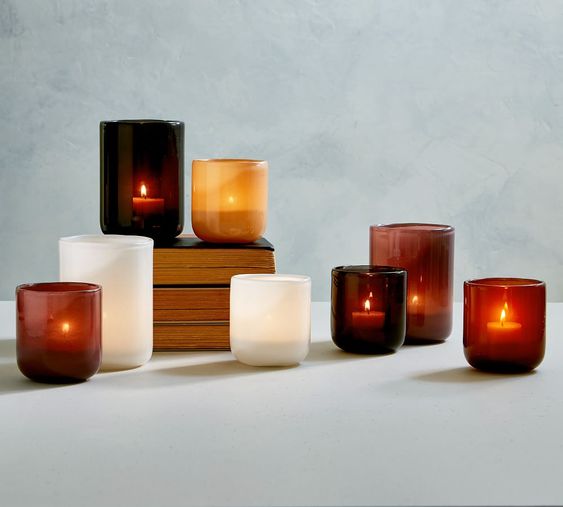
The image size is (563, 507). I want to click on candles, so click(x=62, y=345), click(x=135, y=302), click(x=262, y=321), click(x=245, y=207), click(x=355, y=328), click(x=430, y=244), click(x=511, y=325), click(x=150, y=188).